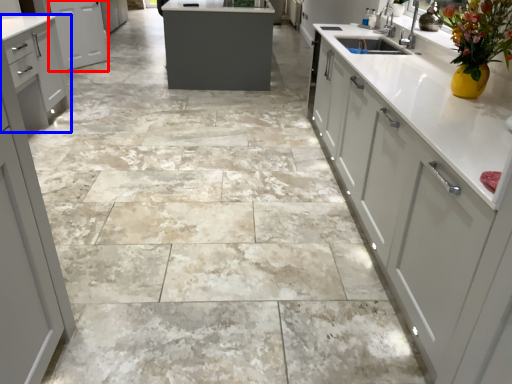
Question: Which point is closer to the camera, cabinetry (highlighted by a red box) or cabinetry (highlighted by a blue box)?

Choices:
 (A) cabinetry
 (B) cabinetry

Answer: (B)